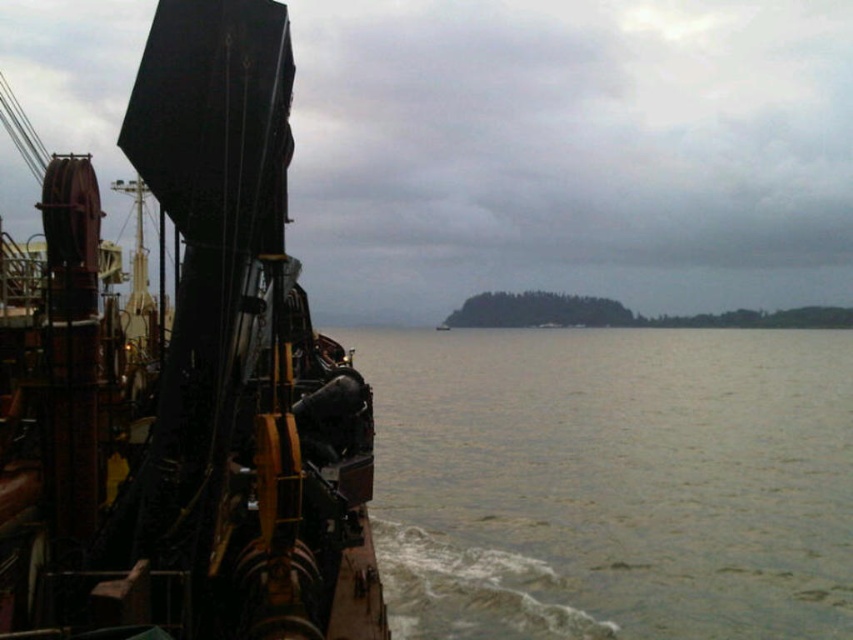
You are on a boat and need to navigate around an obstacle. You see the metallic sheen ship at left and the greenish water at lower left. Which object is positioned higher in your field of view?

The metallic sheen ship at left is above the greenish water at lower left, so it is positioned higher in your field of view.

You are standing on the deck of the boat and want to locate the metallic sheen ship at left. According to the coordinates provided, where would you look relative to your current position?

The metallic sheen ship at left is located at coordinates point (183, 380), which means it is positioned to the left and slightly forward from your current position on the deck.